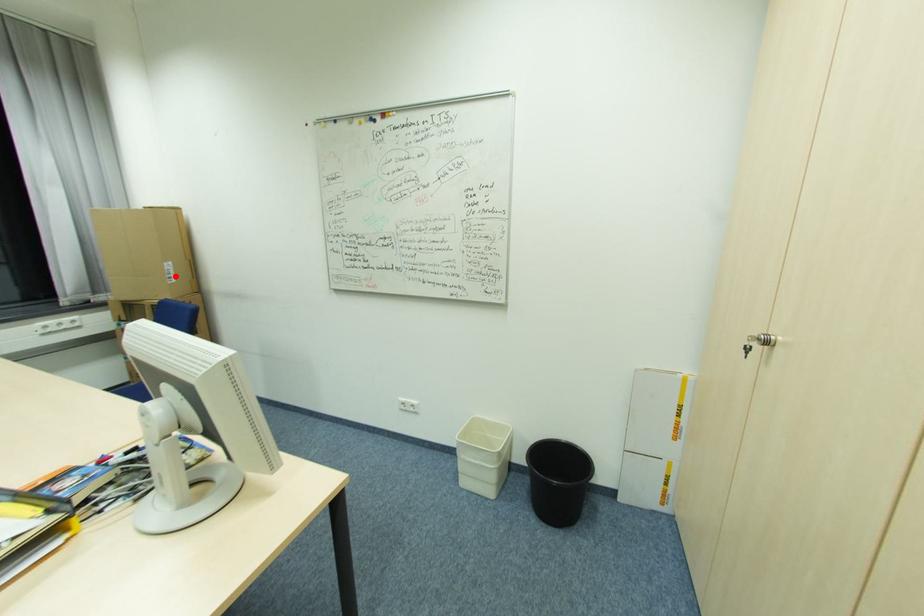
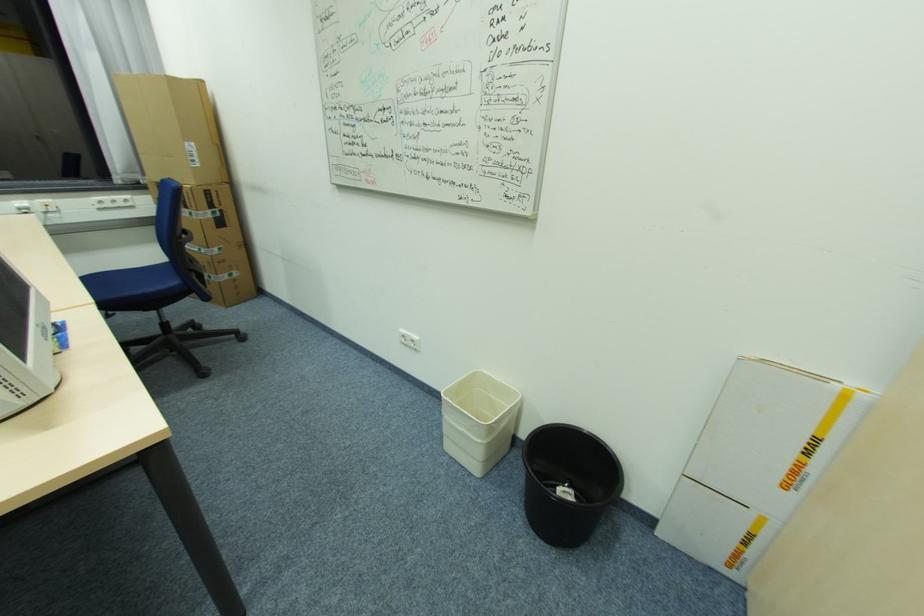
Where in the second image is the point corresponding to the highlighted location from the first image?

(200, 161)